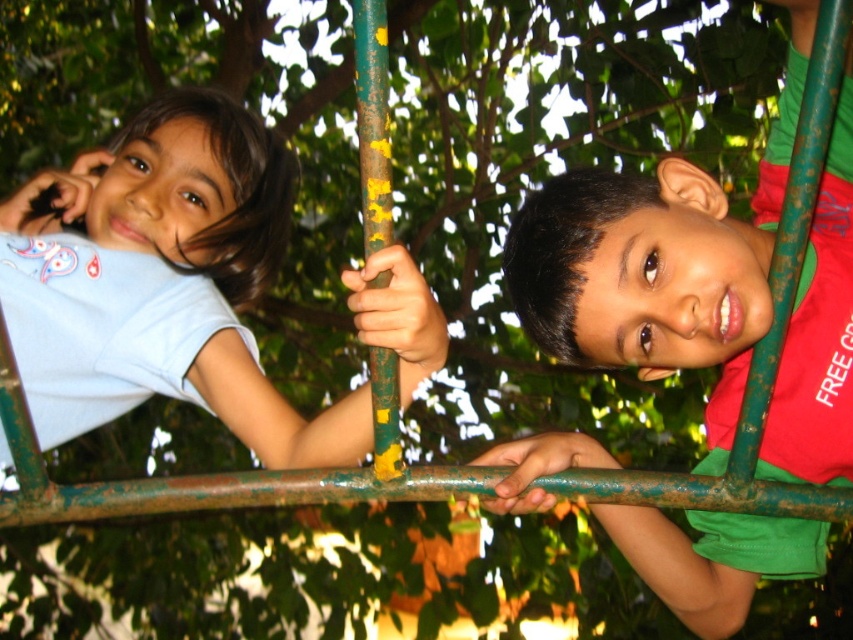
Question: Does green matte shirt at center have a larger size compared to green weathered pole at center?

Choices:
 (A) no
 (B) yes

Answer: (B)

Question: Which of the following is the closest to the observer?

Choices:
 (A) green matte shirt at center
 (B) green weathered pole at center
 (C) matte blue shirt at left

Answer: (B)

Question: Can you confirm if green matte shirt at center is smaller than green weathered pole at center?

Choices:
 (A) no
 (B) yes

Answer: (A)

Question: Considering the real-world distances, which object is closest to the matte blue shirt at left?

Choices:
 (A) green matte shirt at center
 (B) green weathered pole at center

Answer: (B)

Question: In this image, where is matte blue shirt at left located relative to green weathered pole at center?

Choices:
 (A) below
 (B) above

Answer: (A)

Question: Which object is positioned closest to the matte blue shirt at left?

Choices:
 (A) green matte shirt at center
 (B) green weathered pole at center

Answer: (B)